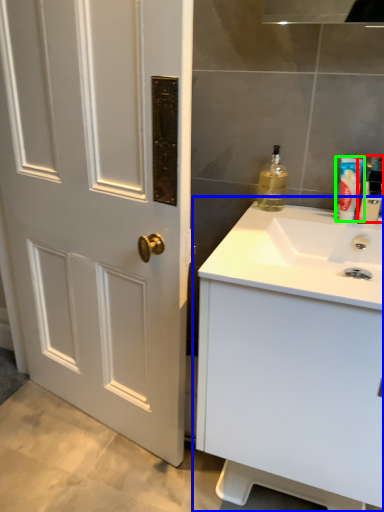
Question: Which is farther away from bottle (highlighted by a red box)? bathroom cabinet (highlighted by a blue box) or mouthwash (highlighted by a green box)?

Choices:
 (A) bathroom cabinet
 (B) mouthwash

Answer: (A)